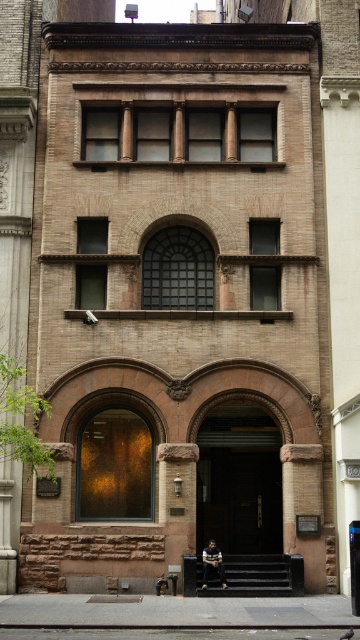
Question: Does brown stone door at center appear on the left side of wooden park bench at lower center?

Choices:
 (A) yes
 (B) no

Answer: (B)

Question: Is brown stone door at center bigger than wooden park bench at lower center?

Choices:
 (A) no
 (B) yes

Answer: (B)

Question: Which point is farther to the camera?

Choices:
 (A) brown stone door at center
 (B) wooden park bench at center
 (C) wooden park bench at lower center

Answer: (A)

Question: Among these points, which one is farthest from the camera?

Choices:
 (A) (262, 468)
 (B) (173, 570)
 (C) (230, 564)

Answer: (A)

Question: Which object is the closest to the wooden park bench at lower center?

Choices:
 (A) wooden park bench at center
 (B) brown stone door at center

Answer: (A)

Question: Can you confirm if brown stone door at center is positioned to the left of wooden park bench at center?

Choices:
 (A) yes
 (B) no

Answer: (B)